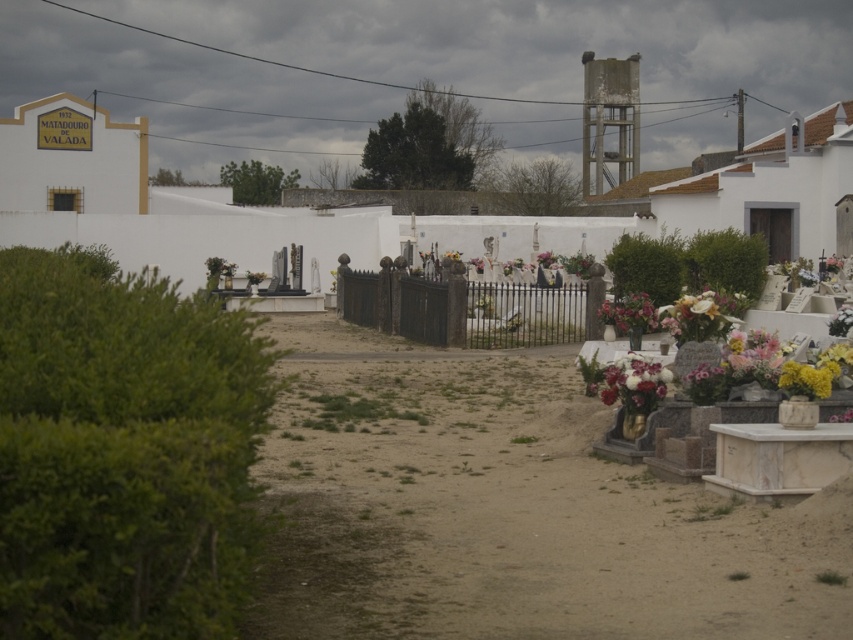
Image resolution: width=853 pixels, height=640 pixels. I want to click on yellow lily at right, so click(701, 316).

Can you confirm if yellow lily at right is positioned below white floral bouquet at lower right?

No, yellow lily at right is not below white floral bouquet at lower right.

What do you see at coordinates (701, 316) in the screenshot? I see `yellow lily at right` at bounding box center [701, 316].

Where is `yellow lily at right`? yellow lily at right is located at coordinates (701, 316).

This screenshot has width=853, height=640. What do you see at coordinates (634, 384) in the screenshot?
I see `white floral bouquet at lower right` at bounding box center [634, 384].

Is point (602, 371) closer to camera compared to point (767, 381)?

No, (602, 371) is further to viewer.

At what (x,y) coordinates should I click in order to perform the action: click on white floral bouquet at lower right. Please return your answer as a coordinate pair (x, y). The image size is (853, 640). Looking at the image, I should click on (634, 384).

Can you confirm if yellow lily at right is positioned below floral bouquet at center-right?

Yes.

Is yellow lily at right taller than floral bouquet at center-right?

No.

Does point (726, 323) lie behind point (630, 300)?

No.

Identify the location of yellow lily at right. (701, 316).